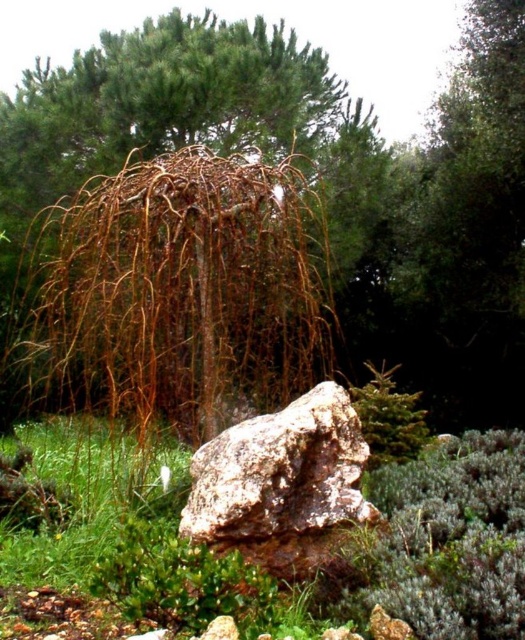
Does brown/dried wood at center appear over green grass at lower left?

Yes, brown/dried wood at center is above green grass at lower left.

Does brown/dried wood at center have a greater height compared to green grass at lower left?

Indeed, brown/dried wood at center has a greater height compared to green grass at lower left.

Between point (47, 166) and point (94, 500), which one is positioned in front?

Positioned in front is point (94, 500).

In order to click on brown/dried wood at center in this screenshot , I will do `click(191, 120)`.

Is rusty stone boulder at center bigger than green grass at lower left?

No, rusty stone boulder at center is not bigger than green grass at lower left.

Describe the element at coordinates (280, 472) in the screenshot. I see `rusty stone boulder at center` at that location.

This screenshot has height=640, width=525. Identify the location of rusty stone boulder at center. (280, 472).

Which of these two, brown/dried wood at center or rusty stone boulder at center, stands taller?

Standing taller between the two is brown/dried wood at center.

You are a GUI agent. You are given a task and a screenshot of the screen. Output one action in this format:
    pyautogui.click(x=<x>, y=<y>)
    Task: Click on the brown/dried wood at center
    This screenshot has width=525, height=640.
    Given the screenshot: What is the action you would take?
    pyautogui.click(x=191, y=120)